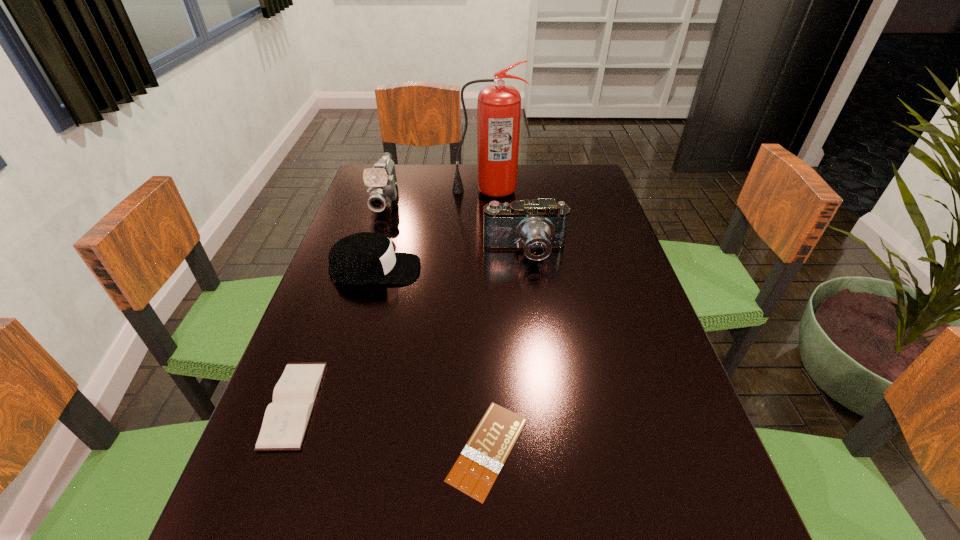
Identify the location of vacant space located on the back of the diary. This screenshot has height=540, width=960. (350, 249).

The image size is (960, 540). What are the coordinates of `free location located on the back of the chocolate bar` in the screenshot? It's located at (487, 333).

You are a GUI agent. You are given a task and a screenshot of the screen. Output one action in this format:
    pyautogui.click(x=<x>, y=<y>)
    Task: Click on the fire extinguisher that is at the far edge
    
    Given the screenshot: What is the action you would take?
    pyautogui.click(x=499, y=106)

This screenshot has height=540, width=960. Find the location of `camcorder situated at the far edge`. camcorder situated at the far edge is located at coordinates (382, 180).

Locate an element on the screen. This screenshot has height=540, width=960. camcorder that is at the left edge is located at coordinates (382, 180).

This screenshot has height=540, width=960. Identify the location of cap that is positioned at the left edge. (367, 257).

Find the location of a particular element. diary positioned at the left edge is located at coordinates [286, 419].

This screenshot has width=960, height=540. Identify the location of object that is at the right edge. click(x=539, y=226).

The width and height of the screenshot is (960, 540). What are the coordinates of `object located in the far left corner section of the desktop` in the screenshot? It's located at (382, 180).

This screenshot has height=540, width=960. I want to click on free region at the far edge of the desktop, so click(x=521, y=178).